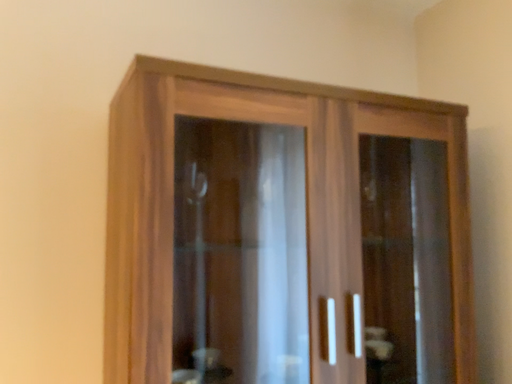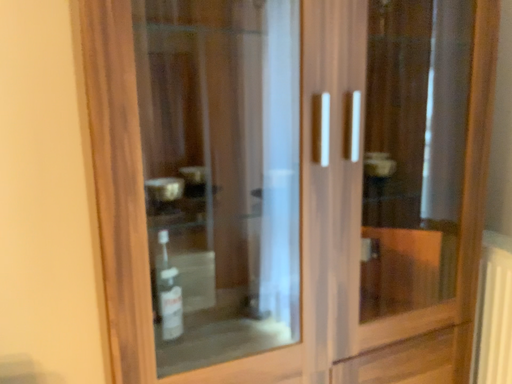
Question: How did the camera likely rotate when shooting the video?

Choices:
 (A) rotated downward
 (B) rotated upward

Answer: (A)